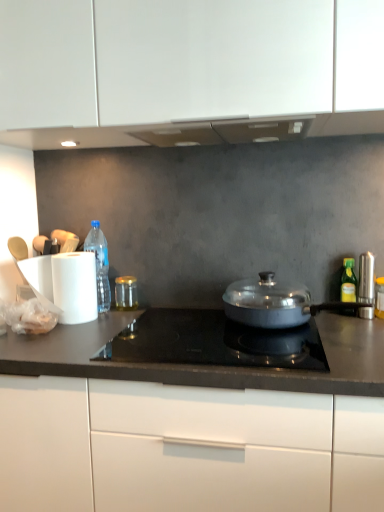
Question: From a real-world perspective, is white matte cabinet at center located higher than satin black cooktop at center?

Choices:
 (A) no
 (B) yes

Answer: (A)

Question: Does white matte cabinet at center appear on the left side of satin black cooktop at center?

Choices:
 (A) yes
 (B) no

Answer: (A)

Question: Considering the relative sizes of white matte cabinet at center and satin black cooktop at center in the image provided, is white matte cabinet at center bigger than satin black cooktop at center?

Choices:
 (A) no
 (B) yes

Answer: (B)

Question: From the image's perspective, is white matte cabinet at center below satin black cooktop at center?

Choices:
 (A) no
 (B) yes

Answer: (B)

Question: Would you say white matte cabinet at center is a long distance from satin black cooktop at center?

Choices:
 (A) no
 (B) yes

Answer: (A)

Question: Considering the relative sizes of white matte cabinet at center and satin black cooktop at center in the image provided, is white matte cabinet at center wider than satin black cooktop at center?

Choices:
 (A) yes
 (B) no

Answer: (A)

Question: Does yellow-green glass bottle at right, positioned as the 1th bottle in front-to-back order, have a lesser height compared to satin silver canister at right?

Choices:
 (A) no
 (B) yes

Answer: (B)

Question: Could satin silver canister at right be considered to be inside yellow-green glass bottle at right, the second bottle when ordered from back to front?

Choices:
 (A) yes
 (B) no

Answer: (B)

Question: Does yellow-green glass bottle at right, the first bottle positioned from the right, have a larger size compared to satin silver canister at right?

Choices:
 (A) yes
 (B) no

Answer: (B)

Question: Is yellow-green glass bottle at right, which is the second bottle in left-to-right order, behind satin silver canister at right?

Choices:
 (A) no
 (B) yes

Answer: (B)

Question: From the image's perspective, would you say yellow-green glass bottle at right, positioned as the 1th bottle in front-to-back order, is positioned over satin silver canister at right?

Choices:
 (A) no
 (B) yes

Answer: (A)

Question: Can you confirm if yellow-green glass bottle at right, positioned as the 1th bottle in front-to-back order, is smaller than satin silver canister at right?

Choices:
 (A) yes
 (B) no

Answer: (A)

Question: Does white matte cabinet at center have a lesser width compared to translucent plastic bottle at left, marked as the 2th bottle in a front-to-back arrangement?

Choices:
 (A) no
 (B) yes

Answer: (A)